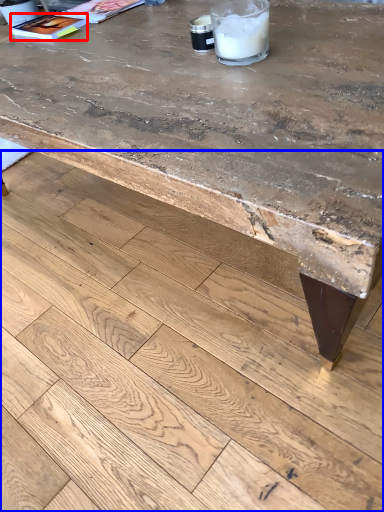
Question: Which point is closer to the camera, magazine (highlighted by a red box) or concrete (highlighted by a blue box)?

Choices:
 (A) magazine
 (B) concrete

Answer: (B)